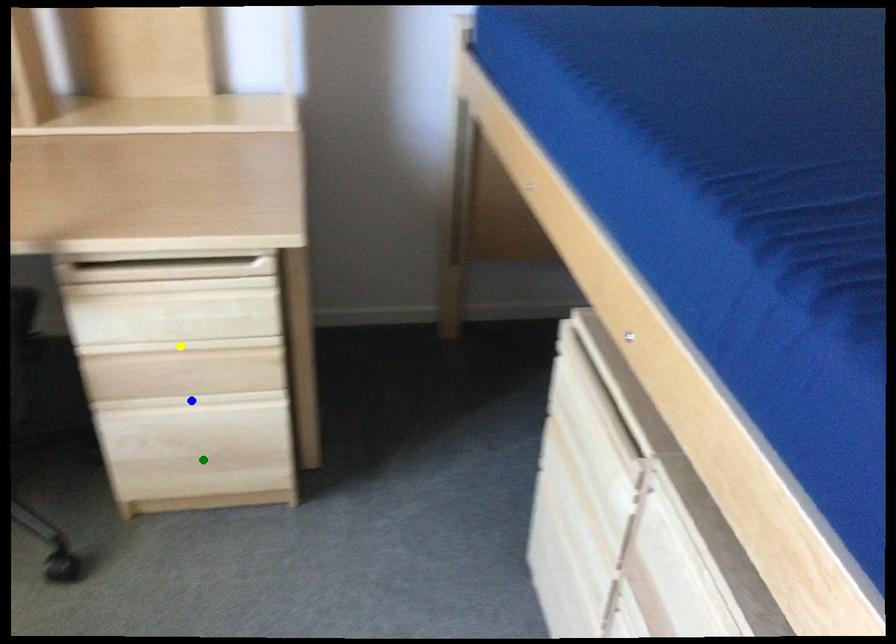
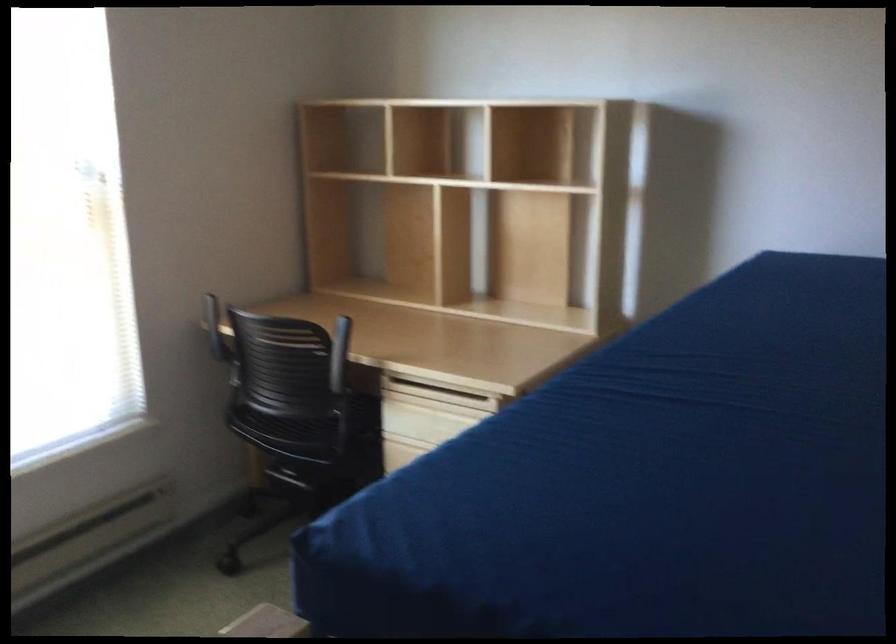
I am providing you with two images of the same scene from different viewpoints. Three points are marked in image1. Which point corresponds to a part or object that is occluded in image2?In image1, three points are marked. Which of them correspond to a part or object that is occluded in image2?Among the three points shown in image1, which one corresponds to a part or object that is no longer visible due to occlusion in image2?

green point, yellow point, blue point